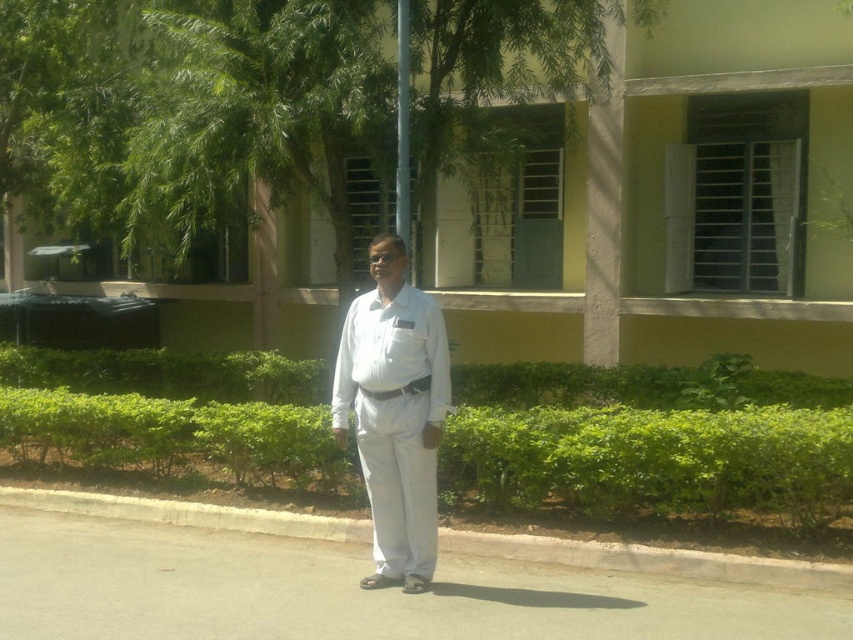
Question: Which of the following is the closest to the observer?

Choices:
 (A) gray concrete curb at lower center
 (B) white cotton shirt at center
 (C) green leafy hedge at center

Answer: (B)

Question: Does white cotton shirt at center have a larger size compared to gray concrete curb at lower center?

Choices:
 (A) no
 (B) yes

Answer: (B)

Question: Which point appears closest to the camera in this image?

Choices:
 (A) coord(192,458)
 (B) coord(48,499)
 (C) coord(416,310)

Answer: (C)

Question: Which point is farther to the camera?

Choices:
 (A) gray concrete curb at lower center
 (B) green leafy hedge at center
 (C) white cotton shirt at center

Answer: (B)

Question: Is green leafy hedge at center wider than gray concrete curb at lower center?

Choices:
 (A) yes
 (B) no

Answer: (B)

Question: Is green leafy hedge at center to the left of white cotton shirt at center from the viewer's perspective?

Choices:
 (A) no
 (B) yes

Answer: (A)